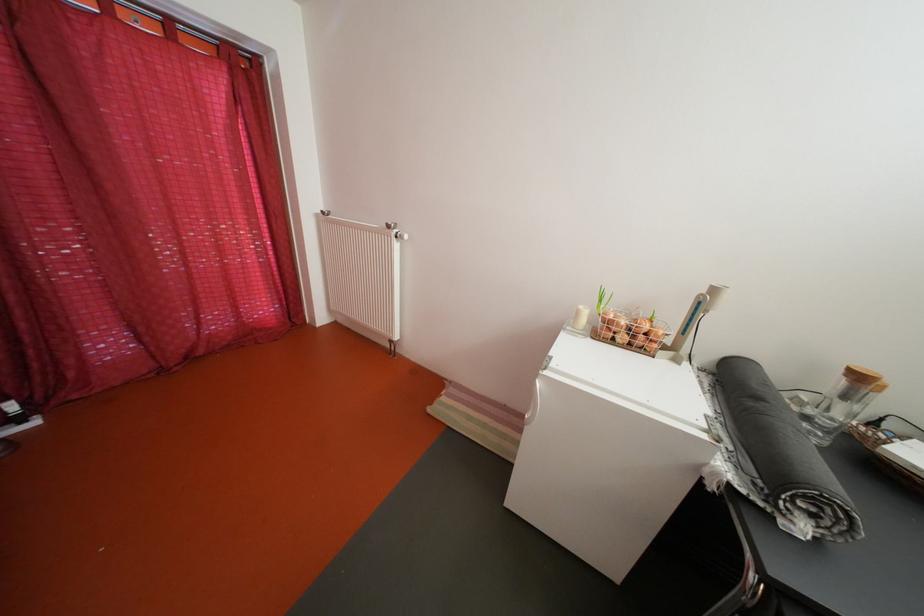
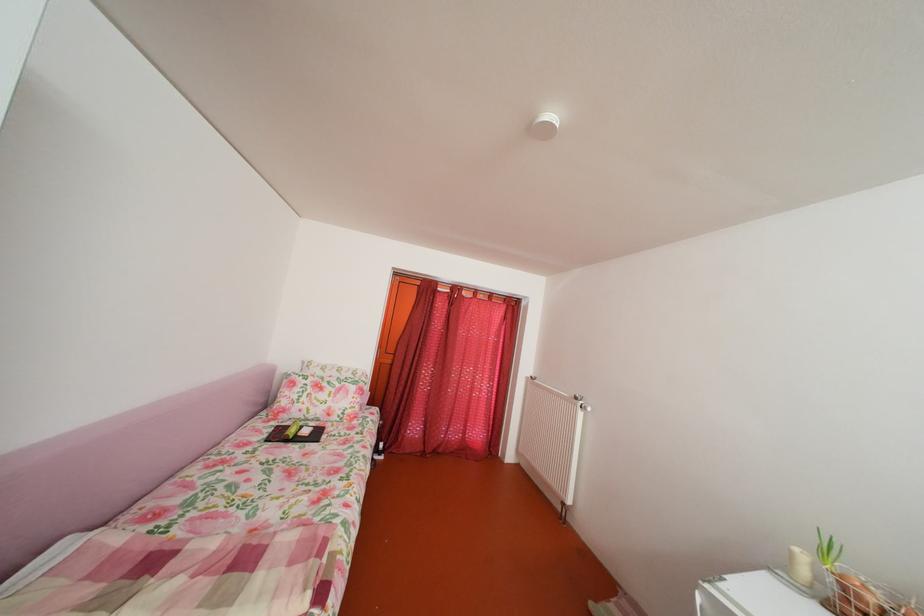
The first image is from the beginning of the video and the second image is from the end. How did the camera likely rotate when shooting the video?

The camera rotated toward left-up.